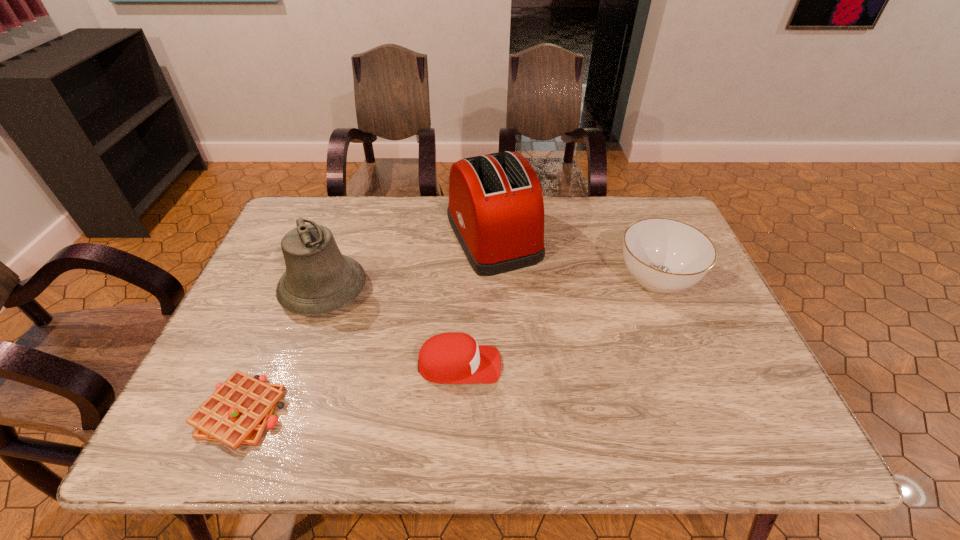
In the image, there is a desktop. What are the coordinates of `free space at the right edge` in the screenshot? It's located at (719, 328).

I want to click on vacant space at the far right corner, so 657,205.

You are a GUI agent. You are given a task and a screenshot of the screen. Output one action in this format:
    pyautogui.click(x=<x>, y=<y>)
    Task: Click on the free space between the bell and the waffle
    Image resolution: width=960 pixels, height=540 pixels.
    Given the screenshot: What is the action you would take?
    pyautogui.click(x=283, y=351)

I want to click on free area in between the third shortest object and the baseball cap, so click(x=558, y=322).

Where is `vacant area that lies between the shortest object and the tallest object`? vacant area that lies between the shortest object and the tallest object is located at coordinates (368, 325).

I want to click on vacant area between the tallest object and the third tallest object, so click(575, 258).

Find the location of a particular element. free spot between the third shortest object and the fourth shortest object is located at coordinates (491, 285).

This screenshot has width=960, height=540. In order to click on vacant space that's between the toaster and the third shortest object in this screenshot , I will do `click(575, 258)`.

Find the location of a particular element. vacant point located between the baseball cap and the toaster is located at coordinates (476, 301).

Locate an element on the screen. Image resolution: width=960 pixels, height=540 pixels. unoccupied area between the rightmost object and the baseball cap is located at coordinates (558, 322).